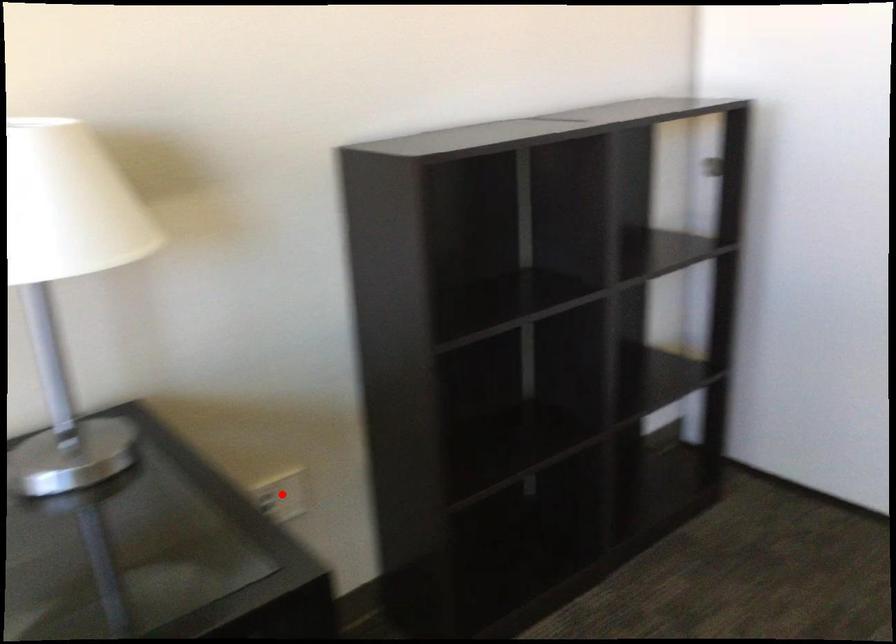
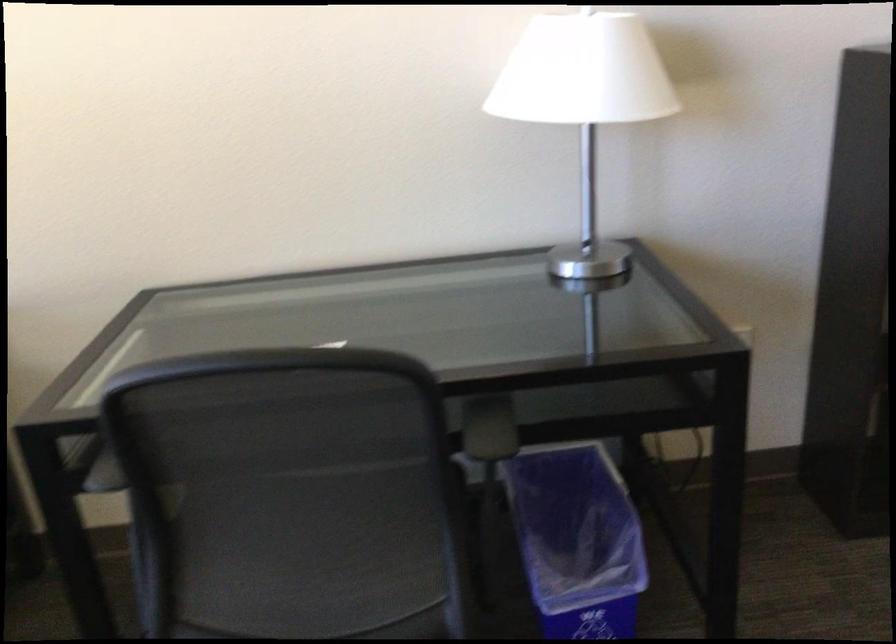
Question: I am providing you with two images of the same scene from different viewpoints. A red point is marked on the first image. At the location where the point appears in image 1, is it still visible in image 2?

Choices:
 (A) Yes
 (B) No

Answer: (B)